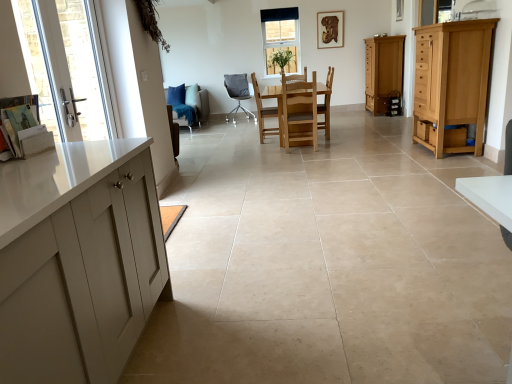
Question: Can you confirm if suede-like beige chair at left, which ranks as the 1th chair in left-to-right order, is thinner than matte gray chair at center, positioned as the second chair in left-to-right order?

Choices:
 (A) no
 (B) yes

Answer: (A)

Question: Is suede-like beige chair at left, which ranks as the 1th chair in left-to-right order, closer to camera compared to matte gray chair at center, positioned as the second chair in left-to-right order?

Choices:
 (A) yes
 (B) no

Answer: (A)

Question: From the image's perspective, is suede-like beige chair at left, the fifth chair positioned from the right, located above matte gray chair at center, positioned as the second chair in left-to-right order?

Choices:
 (A) yes
 (B) no

Answer: (B)

Question: Does suede-like beige chair at left, the fifth chair positioned from the right, have a greater height compared to matte gray chair at center, which is counted as the fourth chair, starting from the right?

Choices:
 (A) yes
 (B) no

Answer: (B)

Question: Can you confirm if suede-like beige chair at left, which ranks as the 1th chair in left-to-right order, is smaller than matte gray chair at center, positioned as the second chair in left-to-right order?

Choices:
 (A) no
 (B) yes

Answer: (A)

Question: From a real-world perspective, is suede-like beige chair at left, which ranks as the 1th chair in left-to-right order, under matte gray chair at center, positioned as the second chair in left-to-right order?

Choices:
 (A) yes
 (B) no

Answer: (A)

Question: Is light brown wood cabinet at right, arranged as the 2th cabinetry when viewed from the back, behind light brown wooden chair at center, acting as the fourth chair starting from the left?

Choices:
 (A) yes
 (B) no

Answer: (B)

Question: Is light brown wooden chair at center, placed as the 2th chair when sorted from right to left, surrounded by light brown wood cabinet at right, arranged as the 2th cabinetry when viewed from the back?

Choices:
 (A) yes
 (B) no

Answer: (B)

Question: Considering the relative sizes of light brown wood cabinet at right, arranged as the 2th cabinetry when viewed from the back, and light brown wooden chair at center, placed as the 2th chair when sorted from right to left, in the image provided, is light brown wood cabinet at right, arranged as the 2th cabinetry when viewed from the back, smaller than light brown wooden chair at center, placed as the 2th chair when sorted from right to left,?

Choices:
 (A) yes
 (B) no

Answer: (A)

Question: Is light brown wood cabinet at right, arranged as the 2th cabinetry when viewed from the back, with light brown wooden chair at center, placed as the 2th chair when sorted from right to left?

Choices:
 (A) yes
 (B) no

Answer: (B)

Question: Is light brown wood cabinet at right, the 1th cabinetry when ordered from front to back, not close to light brown wooden chair at center, acting as the fourth chair starting from the left?

Choices:
 (A) no
 (B) yes

Answer: (B)

Question: Can you confirm if light brown wood cabinet at right, the 1th cabinetry when ordered from front to back, is bigger than light brown wooden chair at center, placed as the 2th chair when sorted from right to left?

Choices:
 (A) no
 (B) yes

Answer: (A)

Question: Would you say wooden drawer at lower right, the 2th drawer when ordered from back to front, contains matte wooden cabinet at right, the 1th cabinetry in the back-to-front sequence?

Choices:
 (A) yes
 (B) no

Answer: (B)